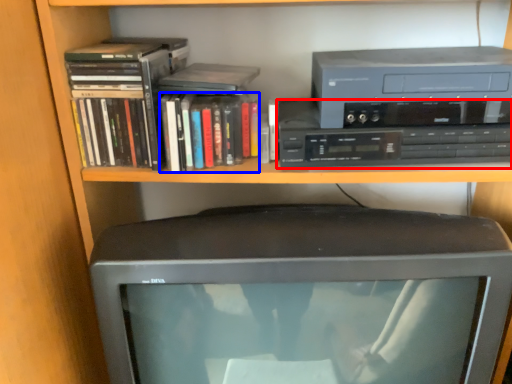
Question: Which object appears farthest to the camera in this image, cassette (highlighted by a red box) or book (highlighted by a blue box)?

Choices:
 (A) cassette
 (B) book

Answer: (B)